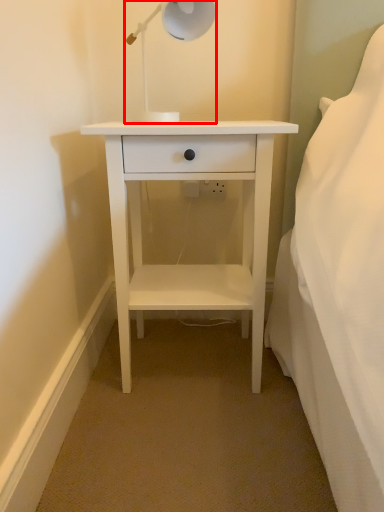
Question: From the image's perspective, considering the relative positions of lamp (annotated by the red box) and nightstand in the image provided, where is lamp (annotated by the red box) located with respect to the staircase?

Choices:
 (A) below
 (B) above

Answer: (B)